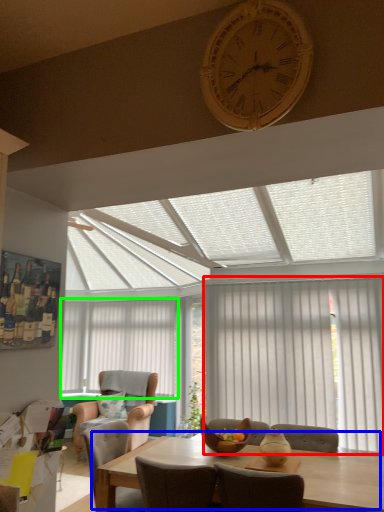
Question: Based on their relative distances, which object is nearer to curtain (highlighted by a red box)? Choose from kitchen & dining room table (highlighted by a blue box) and blind (highlighted by a green box).

Choices:
 (A) kitchen & dining room table
 (B) blind

Answer: (A)